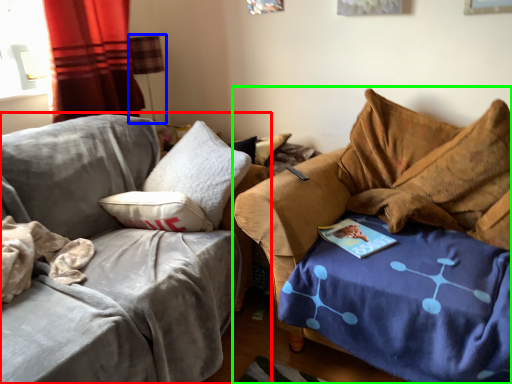
Question: Which object is positioned farthest from studio couch (highlighted by a red box)? Select from lamp (highlighted by a blue box) and studio couch (highlighted by a green box).

Choices:
 (A) lamp
 (B) studio couch

Answer: (A)